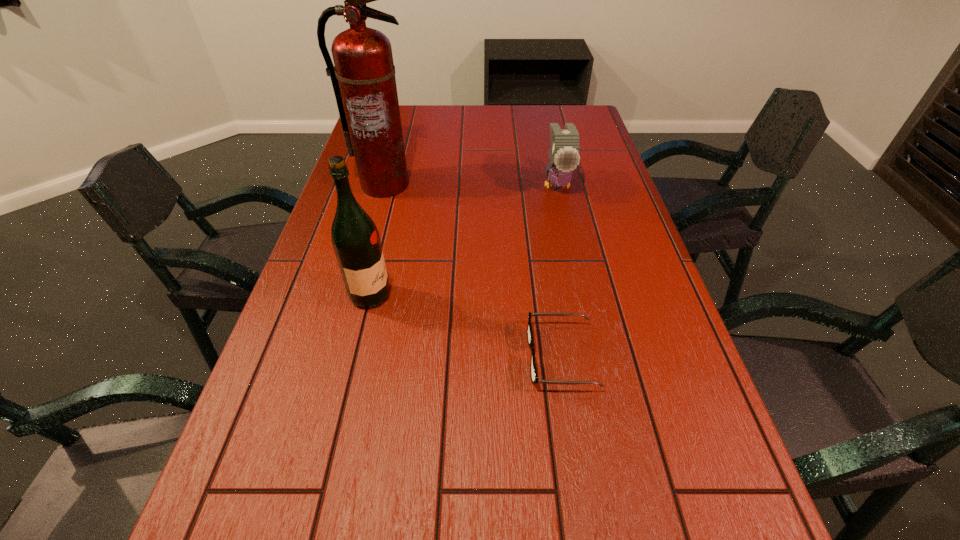
Image resolution: width=960 pixels, height=540 pixels. What are the coordinates of `free spot located on the front-facing side of the nearest object` in the screenshot? It's located at (457, 356).

This screenshot has width=960, height=540. Find the location of `free point located on the front-facing side of the nearest object`. free point located on the front-facing side of the nearest object is located at coordinates (452, 356).

Find the location of a particular element. This screenshot has width=960, height=540. fire extinguisher present at the left edge is located at coordinates (363, 78).

In order to click on liquor at the left edge in this screenshot , I will do `click(355, 238)`.

This screenshot has width=960, height=540. What are the coordinates of `object that is at the right edge` in the screenshot? It's located at (564, 157).

This screenshot has height=540, width=960. What are the coordinates of `free space at the far edge of the desktop` in the screenshot? It's located at (518, 119).

This screenshot has height=540, width=960. Identify the location of vacant space at the right edge of the desktop. (596, 220).

Identify the location of vacant space at the far right corner. (587, 113).

This screenshot has width=960, height=540. What are the coordinates of `blank region between the liquor and the nearest object` in the screenshot? It's located at [466, 326].

Where is `vacant point located between the tallest object and the nearest object`? Image resolution: width=960 pixels, height=540 pixels. vacant point located between the tallest object and the nearest object is located at coordinates (472, 271).